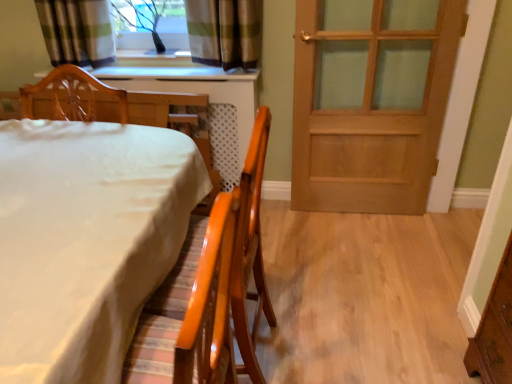
Question: From the image's perspective, is wooden door at right under wooden chair at left, which ranks as the 2th chair in right-to-left order?

Choices:
 (A) yes
 (B) no

Answer: (B)

Question: Is wooden door at right located outside wooden chair at left, which ranks as the 2th chair in right-to-left order?

Choices:
 (A) no
 (B) yes

Answer: (B)

Question: Is the depth of wooden door at right greater than that of wooden chair at left, which appears as the first chair when viewed from the left?

Choices:
 (A) no
 (B) yes

Answer: (B)

Question: From a real-world perspective, does wooden door at right sit lower than wooden chair at left, which appears as the first chair when viewed from the left?

Choices:
 (A) no
 (B) yes

Answer: (B)

Question: Can you confirm if wooden door at right is shorter than wooden chair at left, which appears as the first chair when viewed from the left?

Choices:
 (A) no
 (B) yes

Answer: (A)

Question: Is wooden door at right wider than wooden chair at left, which ranks as the 2th chair in right-to-left order?

Choices:
 (A) no
 (B) yes

Answer: (A)

Question: Is matte orange chair at lower left, which is the second chair from left to right, in front of clear glass window at upper center?

Choices:
 (A) no
 (B) yes

Answer: (B)

Question: Is matte orange chair at lower left, positioned as the 1th chair in right-to-left order, at the left side of clear glass window at upper center?

Choices:
 (A) yes
 (B) no

Answer: (B)

Question: From the image's perspective, would you say matte orange chair at lower left, positioned as the 1th chair in right-to-left order, is shown under clear glass window at upper center?

Choices:
 (A) yes
 (B) no

Answer: (A)

Question: Does matte orange chair at lower left, positioned as the 1th chair in right-to-left order, have a smaller size compared to clear glass window at upper center?

Choices:
 (A) yes
 (B) no

Answer: (B)

Question: Considering the relative sizes of matte orange chair at lower left, positioned as the 1th chair in right-to-left order, and clear glass window at upper center in the image provided, is matte orange chair at lower left, positioned as the 1th chair in right-to-left order, shorter than clear glass window at upper center?

Choices:
 (A) no
 (B) yes

Answer: (A)

Question: Considering the relative sizes of matte orange chair at lower left, positioned as the 1th chair in right-to-left order, and clear glass window at upper center in the image provided, is matte orange chair at lower left, positioned as the 1th chair in right-to-left order, thinner than clear glass window at upper center?

Choices:
 (A) yes
 (B) no

Answer: (B)

Question: Considering the relative positions of wooden chair at left, which ranks as the 2th chair in right-to-left order, and white glossy table at lower left in the image provided, is wooden chair at left, which ranks as the 2th chair in right-to-left order, to the right of white glossy table at lower left from the viewer's perspective?

Choices:
 (A) yes
 (B) no

Answer: (B)